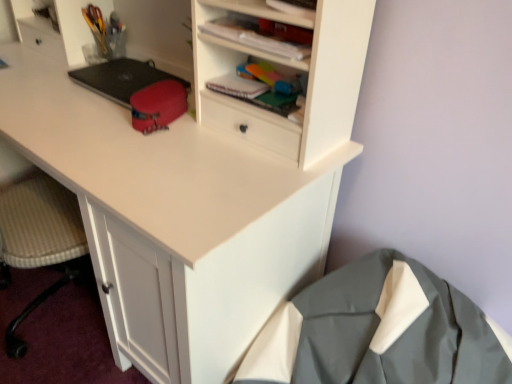
Question: Is matte white cabinet at upper center located outside matte red pouch at center, which is the 2th stationery in left-to-right order?

Choices:
 (A) yes
 (B) no

Answer: (A)

Question: Could matte red pouch at center, which ranks as the first stationery in front-to-back order, be considered to be inside matte white cabinet at upper center?

Choices:
 (A) yes
 (B) no

Answer: (B)

Question: From the image's perspective, would you say matte white cabinet at upper center is positioned over matte red pouch at center, the 2th stationery when ordered from top to bottom?

Choices:
 (A) no
 (B) yes

Answer: (B)

Question: Is matte white cabinet at upper center thinner than matte red pouch at center, which ranks as the first stationery in right-to-left order?

Choices:
 (A) no
 (B) yes

Answer: (B)

Question: Does matte white cabinet at upper center have a larger size compared to matte red pouch at center, which is counted as the second stationery, starting from the back?

Choices:
 (A) yes
 (B) no

Answer: (B)

Question: From a real-world perspective, is matte white cabinet at upper center above or below translucent plastic container at upper left, placed as the first stationery when sorted from left to right?

Choices:
 (A) below
 (B) above

Answer: (B)

Question: Is matte white cabinet at upper center in front of or behind translucent plastic container at upper left, which is counted as the 2th stationery, starting from the bottom, in the image?

Choices:
 (A) front
 (B) behind

Answer: (A)

Question: In terms of width, does matte white cabinet at upper center look wider or thinner when compared to translucent plastic container at upper left, which appears as the 1th stationery when viewed from the back?

Choices:
 (A) thin
 (B) wide

Answer: (B)

Question: Is point (300, 61) positioned closer to the camera than point (102, 52)?

Choices:
 (A) closer
 (B) farther

Answer: (A)

Question: From a real-world perspective, relative to gray fabric coat at lower right, is translucent plastic container at upper left, which appears as the 1th stationery when viewed from the back, vertically above or below?

Choices:
 (A) below
 (B) above

Answer: (B)

Question: In terms of height, does translucent plastic container at upper left, the 1th stationery from the top, look taller or shorter compared to gray fabric coat at lower right?

Choices:
 (A) tall
 (B) short

Answer: (B)

Question: From the image's perspective, is translucent plastic container at upper left, which appears as the 1th stationery when viewed from the back, located above or below gray fabric coat at lower right?

Choices:
 (A) below
 (B) above

Answer: (B)

Question: Does point (110, 24) appear closer or farther from the camera than point (370, 291)?

Choices:
 (A) closer
 (B) farther

Answer: (B)

Question: Considering the positions of translucent plastic container at upper left, the second stationery when ordered from right to left, and matte white cabinet at upper center in the image, is translucent plastic container at upper left, the second stationery when ordered from right to left, taller or shorter than matte white cabinet at upper center?

Choices:
 (A) short
 (B) tall

Answer: (B)

Question: In terms of width, does translucent plastic container at upper left, placed as the first stationery when sorted from left to right, look wider or thinner when compared to matte white cabinet at upper center?

Choices:
 (A) wide
 (B) thin

Answer: (B)